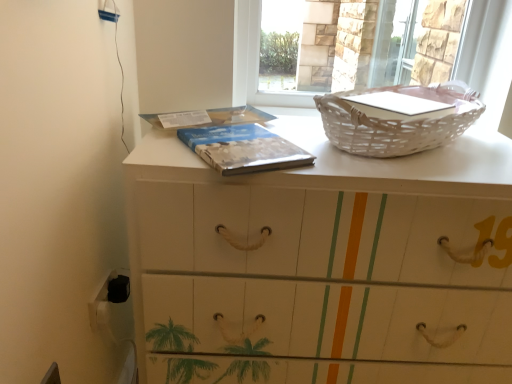
Question: From a real-world perspective, is white wicker basket at upper right located higher than blue textured book at center?

Choices:
 (A) yes
 (B) no

Answer: (A)

Question: From the image's perspective, would you say white wicker basket at upper right is shown under blue textured book at center?

Choices:
 (A) yes
 (B) no

Answer: (B)

Question: Is white wicker basket at upper right aimed at blue textured book at center?

Choices:
 (A) yes
 (B) no

Answer: (B)

Question: Is the depth of white wicker basket at upper right greater than that of blue textured book at center?

Choices:
 (A) no
 (B) yes

Answer: (B)

Question: Is white wicker basket at upper right at the left side of blue textured book at center?

Choices:
 (A) no
 (B) yes

Answer: (A)

Question: Relative to transparent glass screen door at upper center, is blue textured book at center in front or behind?

Choices:
 (A) front
 (B) behind

Answer: (A)

Question: Considering the positions of blue textured book at center and transparent glass screen door at upper center in the image, is blue textured book at center wider or thinner than transparent glass screen door at upper center?

Choices:
 (A) thin
 (B) wide

Answer: (B)

Question: From a real-world perspective, is blue textured book at center above or below transparent glass screen door at upper center?

Choices:
 (A) above
 (B) below

Answer: (B)

Question: In terms of size, does blue textured book at center appear bigger or smaller than transparent glass screen door at upper center?

Choices:
 (A) big
 (B) small

Answer: (B)

Question: Is white wicker basket at upper right inside or outside of transparent glass screen door at upper center?

Choices:
 (A) inside
 (B) outside

Answer: (B)

Question: From a real-world perspective, is white wicker basket at upper right positioned above or below transparent glass screen door at upper center?

Choices:
 (A) above
 (B) below

Answer: (B)

Question: Is white wicker basket at upper right taller or shorter than transparent glass screen door at upper center?

Choices:
 (A) short
 (B) tall

Answer: (A)

Question: Relative to transparent glass screen door at upper center, is white wicker basket at upper right in front or behind?

Choices:
 (A) behind
 (B) front

Answer: (B)

Question: From their relative heights in the image, would you say blue textured book at center is taller or shorter than white wicker basket at upper right?

Choices:
 (A) tall
 (B) short

Answer: (B)

Question: From the image's perspective, relative to white wicker basket at upper right, is blue textured book at center above or below?

Choices:
 (A) below
 (B) above

Answer: (A)